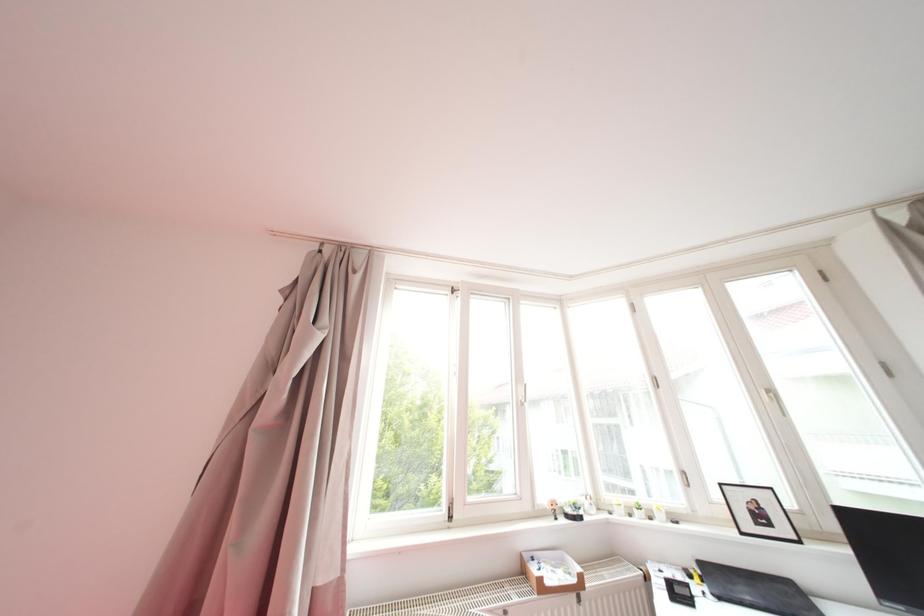
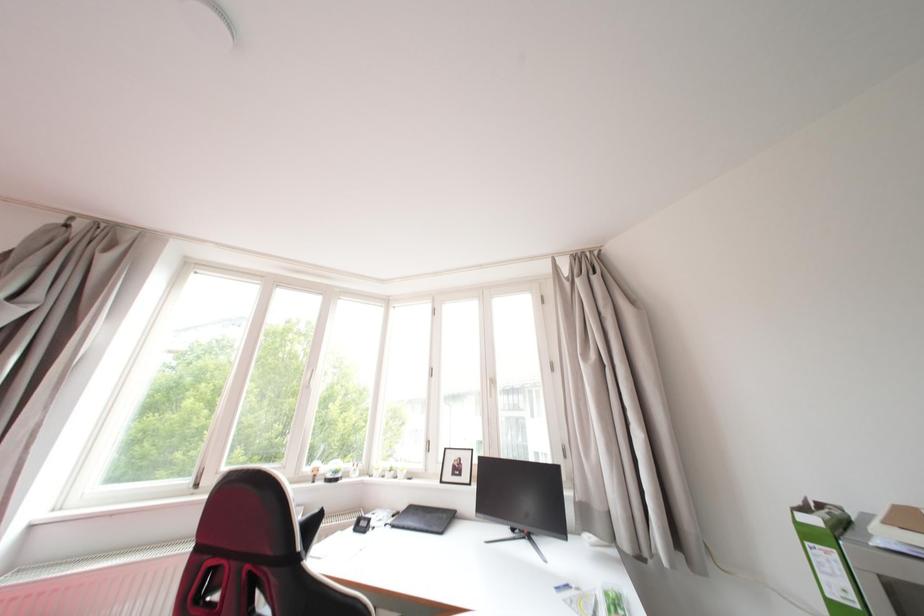
Which direction would the cameraman need to move to produce the second image?

The movement direction of the cameraman is right, backward.